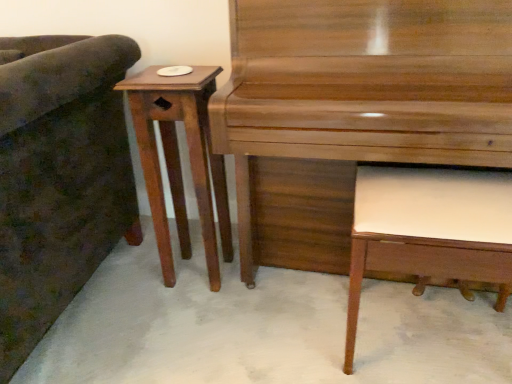
Image resolution: width=512 pixels, height=384 pixels. Find the location of `free space in front of mahogany wood side table at left`. free space in front of mahogany wood side table at left is located at coordinates (192, 316).